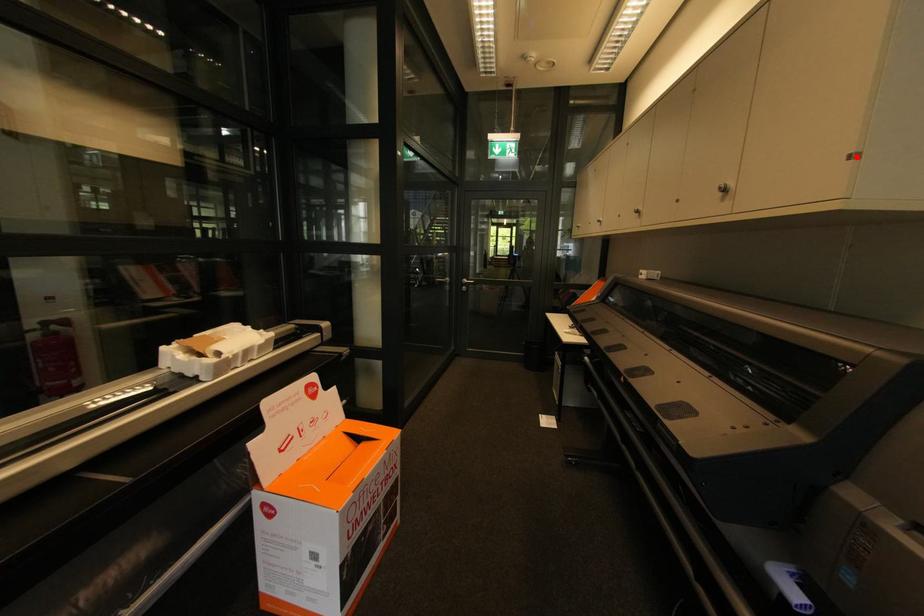
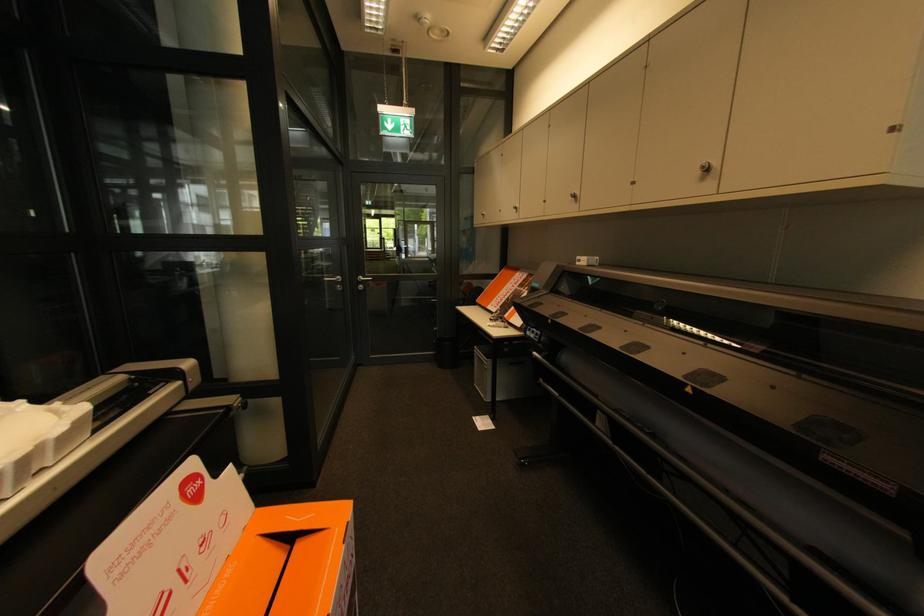
The point at the highlighted location is marked in the first image. Where is the corresponding point in the second image?

(895, 130)